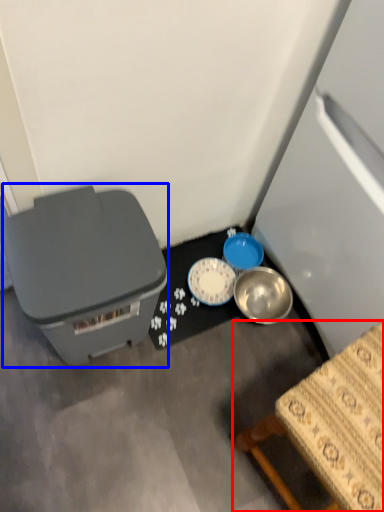
Question: Which object appears closest to the camera in this image, furniture (highlighted by a red box) or storage box (highlighted by a blue box)?

Choices:
 (A) furniture
 (B) storage box

Answer: (A)